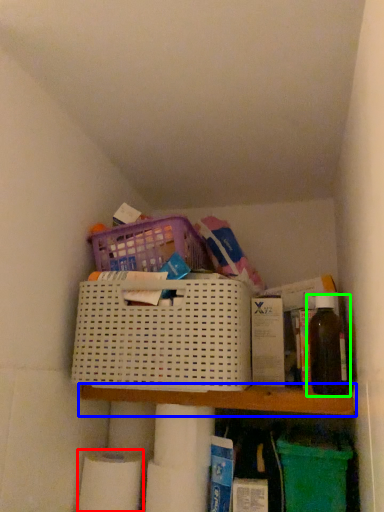
Question: Considering the real-world distances, which object is closest to toilet paper (highlighted by a red box)? shelf (highlighted by a blue box) or bottle (highlighted by a green box).

Choices:
 (A) shelf
 (B) bottle

Answer: (A)